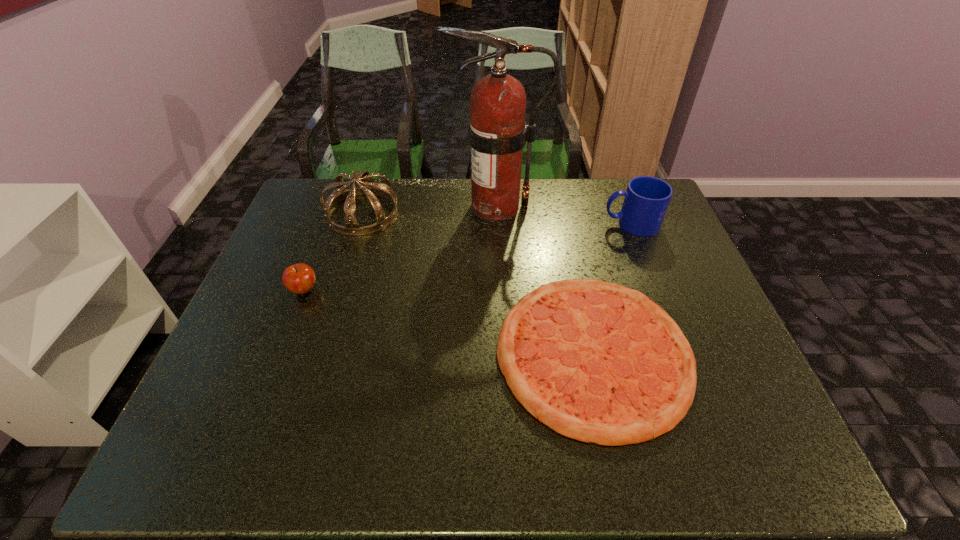
This screenshot has height=540, width=960. What are the coordinates of `free area in between the mug and the tallest object` in the screenshot? It's located at (564, 215).

Find the location of a particular element. This screenshot has width=960, height=540. vacant point located between the tiara and the shortest object is located at coordinates (478, 283).

Identify the location of empty space that is in between the shortest object and the tallest object. The height and width of the screenshot is (540, 960). (545, 280).

Identify the location of free space between the apple and the fire extinguisher. (400, 248).

Where is `free spot between the mug and the fire extinguisher`? The image size is (960, 540). free spot between the mug and the fire extinguisher is located at coordinates click(564, 215).

This screenshot has width=960, height=540. Find the location of `free space between the shortest object and the fourth tallest object`. free space between the shortest object and the fourth tallest object is located at coordinates (448, 321).

I want to click on empty location between the tallest object and the third tallest object, so click(x=564, y=215).

Locate an element on the screen. This screenshot has width=960, height=540. free space between the third shortest object and the fourth tallest object is located at coordinates (468, 256).

The image size is (960, 540). Find the location of `free space that is in between the fire extinguisher and the third shortest object`. free space that is in between the fire extinguisher and the third shortest object is located at coordinates (564, 215).

Locate an element on the screen. The width and height of the screenshot is (960, 540). empty location between the mug and the fire extinguisher is located at coordinates pos(564,215).